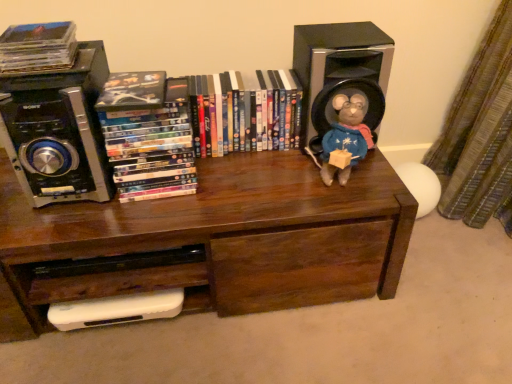
Find the location of `free space between matte plastic dvds at left, positioned as the second book in left-to-right order, and matte plastic dvds at center, which ranks as the 3th book in left-to-right order`. free space between matte plastic dvds at left, positioned as the second book in left-to-right order, and matte plastic dvds at center, which ranks as the 3th book in left-to-right order is located at coordinates (237, 166).